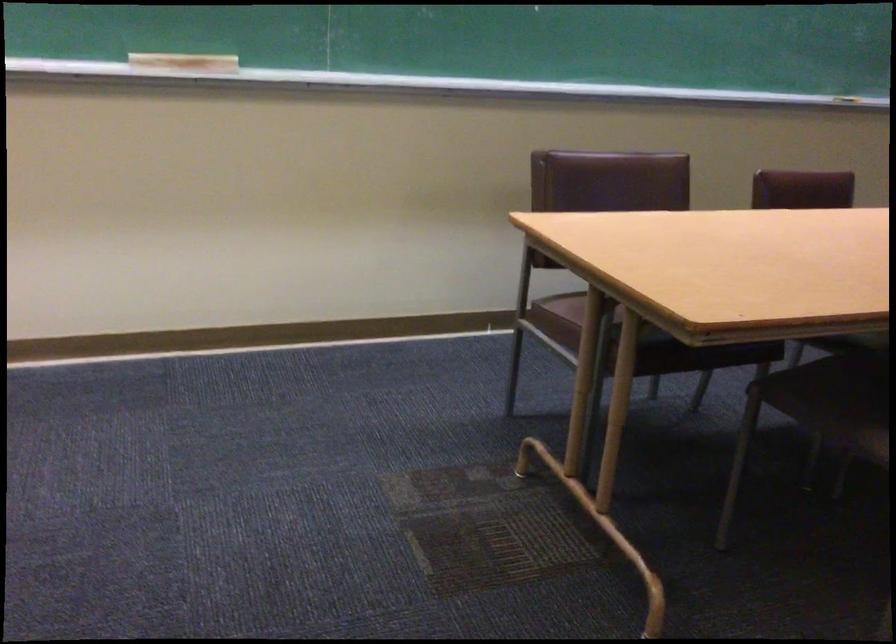
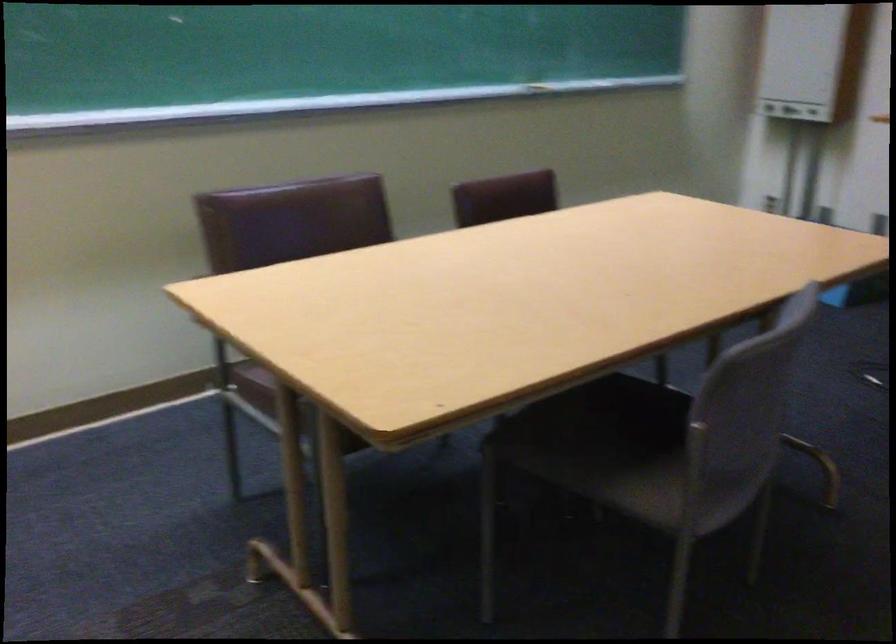
In the second image, find the point that corresponds to the point at 570,308 in the first image.

(277, 375)